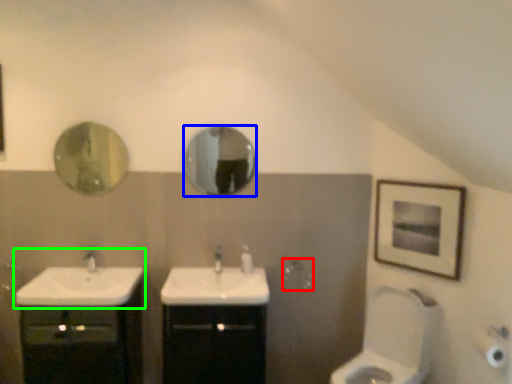
Question: Estimate the real-world distances between objects in this image. Which object is farther from towel bar (highlighted by a red box), mirror (highlighted by a blue box) or sink (highlighted by a green box)?

Choices:
 (A) mirror
 (B) sink

Answer: (B)